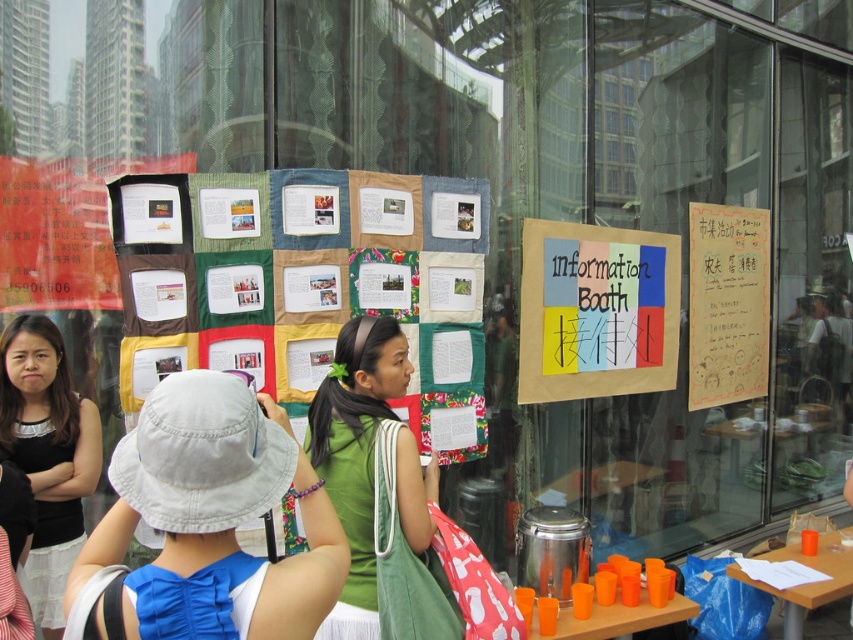
Can you confirm if textured fabric bulletin board at center is wider than matte paper poster at center?

Yes.

Is textured fabric bulletin board at center shorter than matte paper poster at center?

No.

The image size is (853, 640). In order to click on textured fabric bulletin board at center in this screenshot , I will do `click(309, 285)`.

Is the position of multicolored paper sign at center less distant than that of matte paper poster at center?

No, multicolored paper sign at center is further to the viewer.

Looking at this image, who is more forward, (x=654, y=371) or (x=257, y=216)?

Point (x=257, y=216)

Image resolution: width=853 pixels, height=640 pixels. I want to click on multicolored paper sign at center, so click(x=596, y=310).

The width and height of the screenshot is (853, 640). What do you see at coordinates (309, 285) in the screenshot? I see `textured fabric bulletin board at center` at bounding box center [309, 285].

Can you confirm if textured fabric bulletin board at center is positioned to the right of multicolored paper sign at center?

Incorrect, textured fabric bulletin board at center is not on the right side of multicolored paper sign at center.

Which is in front, point (294, 387) or point (531, 225)?

Positioned in front is point (294, 387).

Locate an element on the screen. This screenshot has height=640, width=853. textured fabric bulletin board at center is located at coordinates [309, 285].